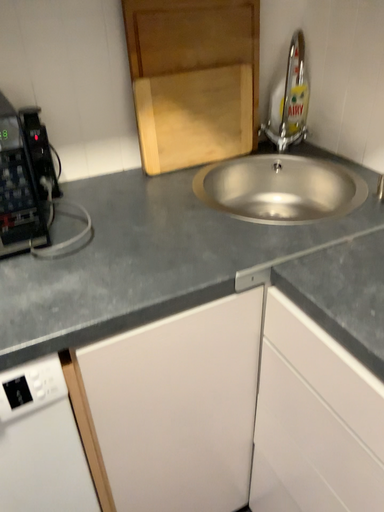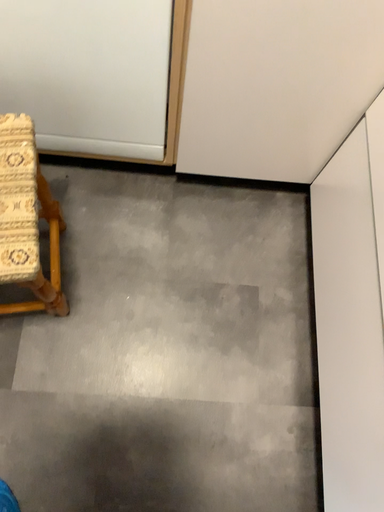
Question: How did the camera likely rotate when shooting the video?

Choices:
 (A) rotated upward
 (B) rotated downward

Answer: (B)